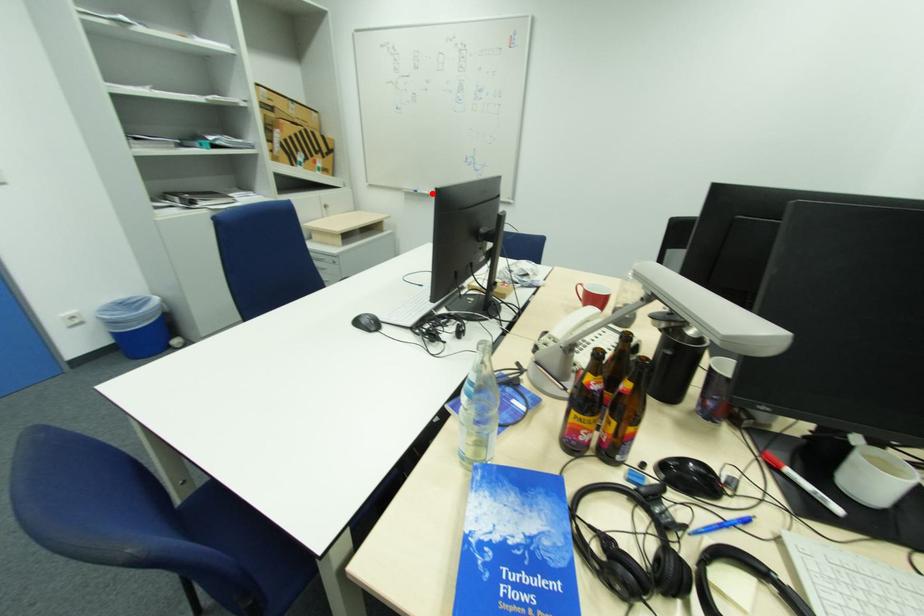
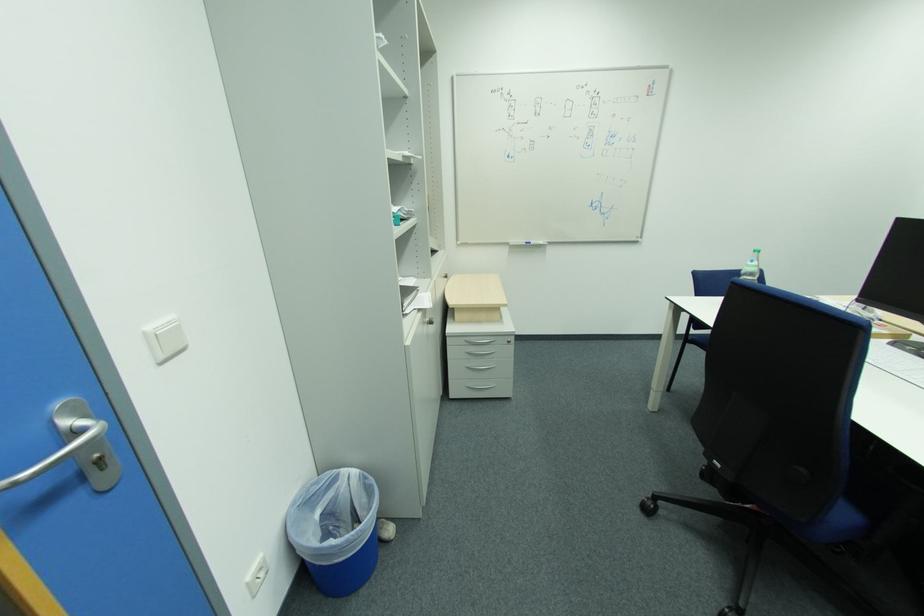
Where in the second image is the point corresponding to the highlighted location from the first image?

(546, 244)